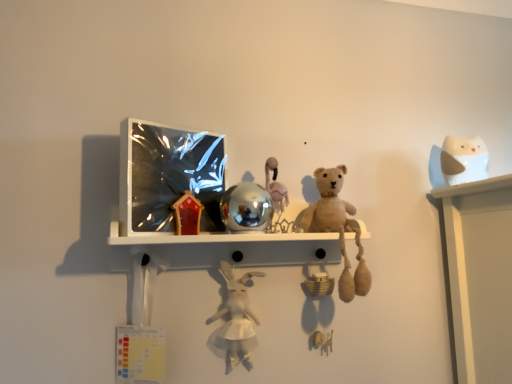
Question: Should I look upward or downward to see white plush rabbit at center, which is the first toy in left-to-right order?

Choices:
 (A) down
 (B) up

Answer: (A)

Question: Is fuzzy beige teddy bear at center, marked as the second toy in a right-to-left arrangement, to the left of white plush rabbit at center, which is the first toy in left-to-right order, from the viewer's perspective?

Choices:
 (A) yes
 (B) no

Answer: (B)

Question: Can you confirm if fuzzy beige teddy bear at center, marked as the second toy in a right-to-left arrangement, is bigger than white plush rabbit at center, which appears as the 4th toy when viewed from the right?

Choices:
 (A) yes
 (B) no

Answer: (A)

Question: Is fuzzy beige teddy bear at center, marked as the second toy in a right-to-left arrangement, oriented towards white plush rabbit at center, which is the first toy in left-to-right order?

Choices:
 (A) yes
 (B) no

Answer: (B)

Question: Considering the relative sizes of fuzzy beige teddy bear at center, marked as the second toy in a right-to-left arrangement, and white plush rabbit at center, which is the first toy in left-to-right order, in the image provided, is fuzzy beige teddy bear at center, marked as the second toy in a right-to-left arrangement, thinner than white plush rabbit at center, which is the first toy in left-to-right order,?

Choices:
 (A) yes
 (B) no

Answer: (B)

Question: From a real-world perspective, is fuzzy beige teddy bear at center, marked as the second toy in a right-to-left arrangement, located higher than white plush rabbit at center, which is the first toy in left-to-right order?

Choices:
 (A) no
 (B) yes

Answer: (B)

Question: Is fuzzy beige teddy bear at center, marked as the second toy in a right-to-left arrangement, taller than white plush rabbit at center, which is the first toy in left-to-right order?

Choices:
 (A) no
 (B) yes

Answer: (B)

Question: Can you confirm if metallic reflective shelf at center is smaller than shiny metallic ball at center, which is counted as the third toy, starting from the right?

Choices:
 (A) no
 (B) yes

Answer: (A)

Question: Does metallic reflective shelf at center lie in front of shiny metallic ball at center, which is counted as the third toy, starting from the right?

Choices:
 (A) yes
 (B) no

Answer: (B)

Question: From a real-world perspective, is metallic reflective shelf at center physically above shiny metallic ball at center, which is counted as the second toy, starting from the left?

Choices:
 (A) yes
 (B) no

Answer: (B)

Question: Is metallic reflective shelf at center far away from shiny metallic ball at center, which is counted as the second toy, starting from the left?

Choices:
 (A) no
 (B) yes

Answer: (A)

Question: Is shiny metallic ball at center, which is counted as the third toy, starting from the right, a part of metallic reflective shelf at center?

Choices:
 (A) yes
 (B) no

Answer: (B)

Question: Can you confirm if metallic reflective shelf at center is wider than shiny metallic ball at center, which is counted as the second toy, starting from the left?

Choices:
 (A) no
 (B) yes

Answer: (B)

Question: Is shiny metallic ball at center, which is counted as the second toy, starting from the left, shorter than white matte owl at upper right, which appears as the 4th toy when viewed from the left?

Choices:
 (A) no
 (B) yes

Answer: (B)